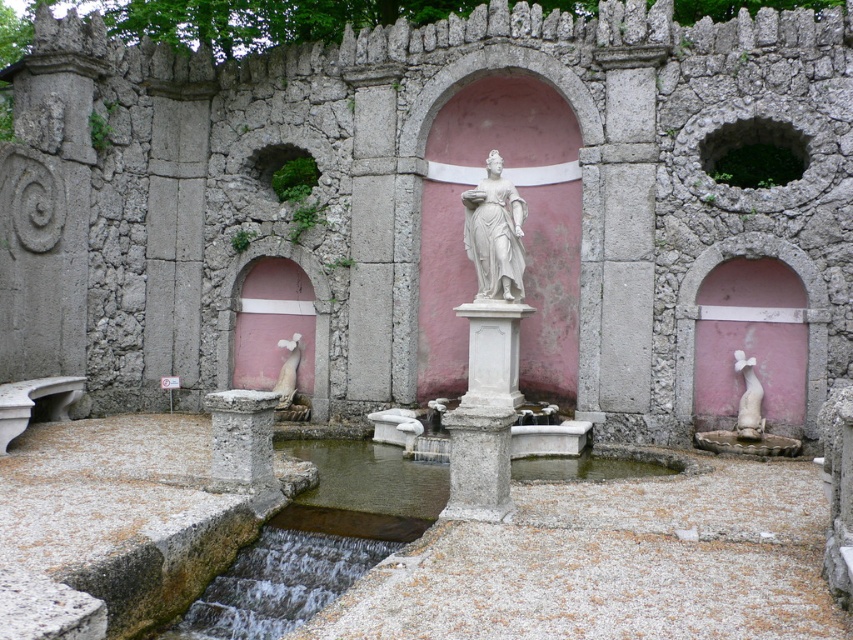
Is white stone pillar at center closer to camera compared to white marble statue at lower right?

Yes, it is in front of white marble statue at lower right.

Which is in front, point (480, 307) or point (737, 417)?

Point (480, 307) is in front.

The image size is (853, 640). I want to click on white stone pillar at center, so click(485, 412).

Can you confirm if gray stone pillar at center is positioned to the left of white marble statue at lower right?

Correct, you'll find gray stone pillar at center to the left of white marble statue at lower right.

Does point (259, 474) come closer to viewer compared to point (735, 349)?

Yes, point (259, 474) is closer to viewer.

Find the location of a particular element. Image resolution: width=853 pixels, height=640 pixels. gray stone pillar at center is located at coordinates (241, 435).

Can you confirm if gray stone pillar at center is positioned to the right of white marble fountain at lower right?

Incorrect, gray stone pillar at center is not on the right side of white marble fountain at lower right.

Does gray stone pillar at center appear on the left side of white marble fountain at lower right?

Yes, gray stone pillar at center is to the left of white marble fountain at lower right.

Which is behind, point (235, 400) or point (743, 392)?

Positioned behind is point (743, 392).

This screenshot has width=853, height=640. What are the coordinates of `gray stone pillar at center` in the screenshot? It's located at (241, 435).